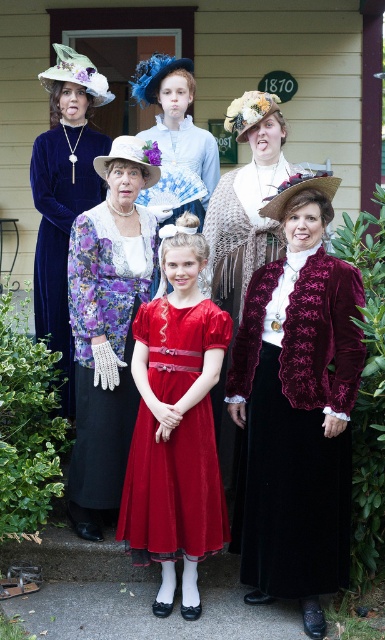
Question: Which object is the closest to the velvet/red dress at center?

Choices:
 (A) velvet burgundy jacket at center
 (B) velvet floral dress at center

Answer: (A)

Question: Does velvet floral dress at center lie in front of velvet/red dress at center?

Choices:
 (A) no
 (B) yes

Answer: (A)

Question: Which point is farther to the camera?

Choices:
 (A) (170, 499)
 (B) (246, 433)
 (C) (43, 268)
 (D) (82, 321)

Answer: (C)

Question: Can you confirm if velvet burgundy jacket at center is positioned above velvet floral dress at center?

Choices:
 (A) no
 (B) yes

Answer: (A)

Question: Is velvet burgundy jacket at center to the right of velvet dress at upper left from the viewer's perspective?

Choices:
 (A) no
 (B) yes

Answer: (B)

Question: Which is farther from the velvet dress at upper left?

Choices:
 (A) velvet burgundy jacket at center
 (B) velvet floral dress at center
 (C) velvet/red dress at center

Answer: (A)